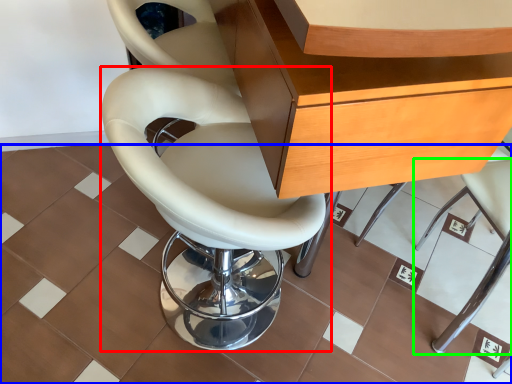
Question: Considering the real-world distances, which object is closest to chair (highlighted by a red box)? ceramic tile (highlighted by a blue box) or chair (highlighted by a green box).

Choices:
 (A) ceramic tile
 (B) chair

Answer: (A)